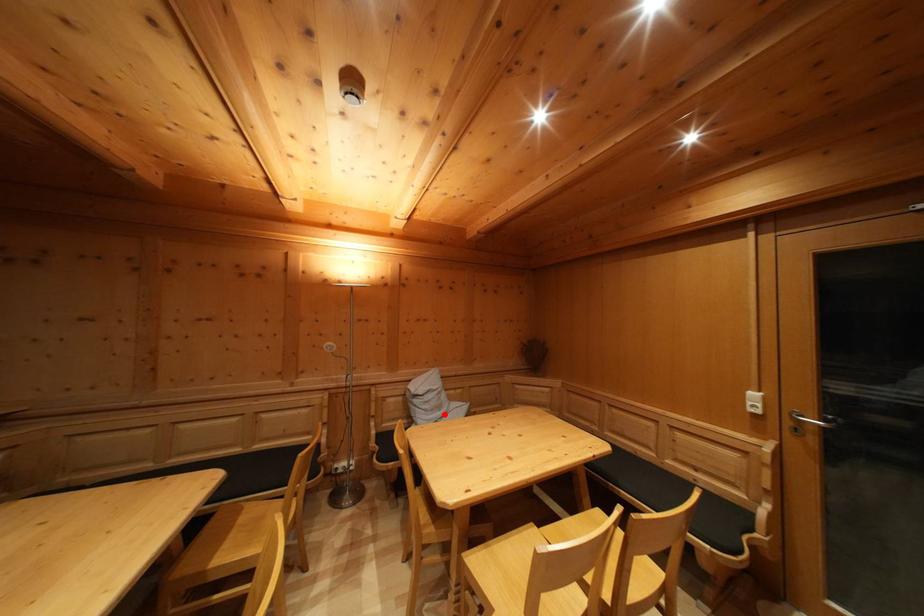
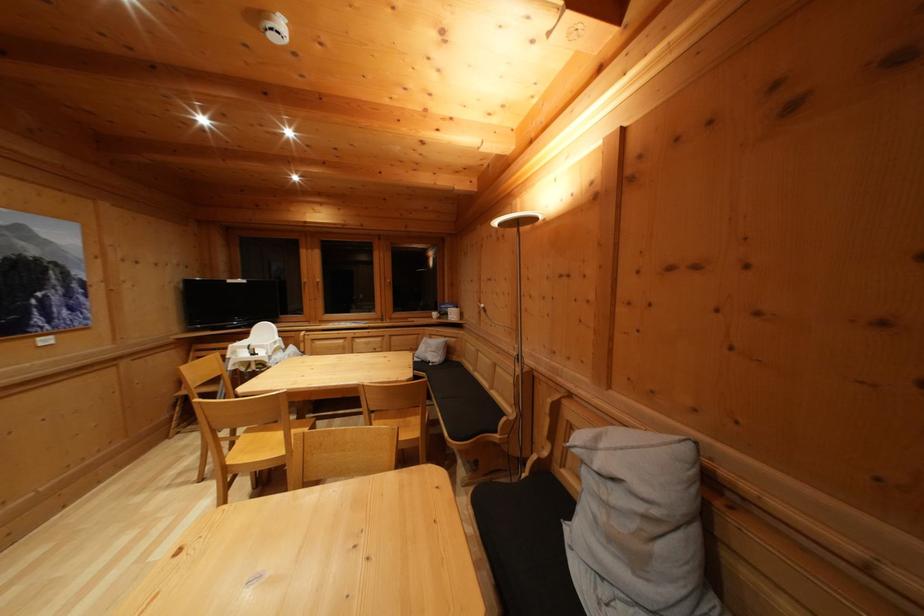
The point at the highlighted location is marked in the first image. Where is the corresponding point in the second image?

(640, 565)